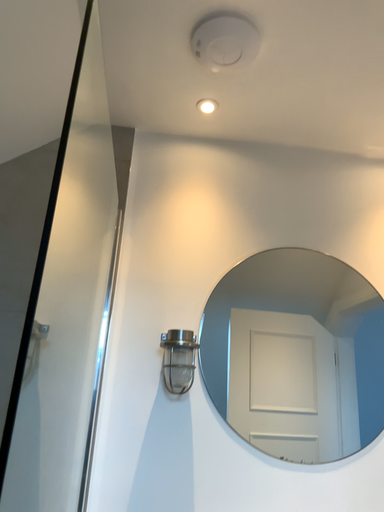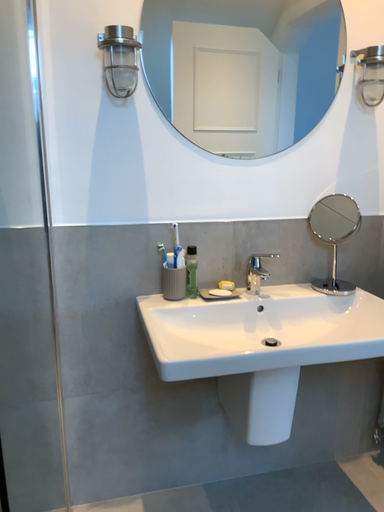
Question: Which way did the camera rotate in the video?

Choices:
 (A) rotated downward
 (B) rotated upward

Answer: (A)